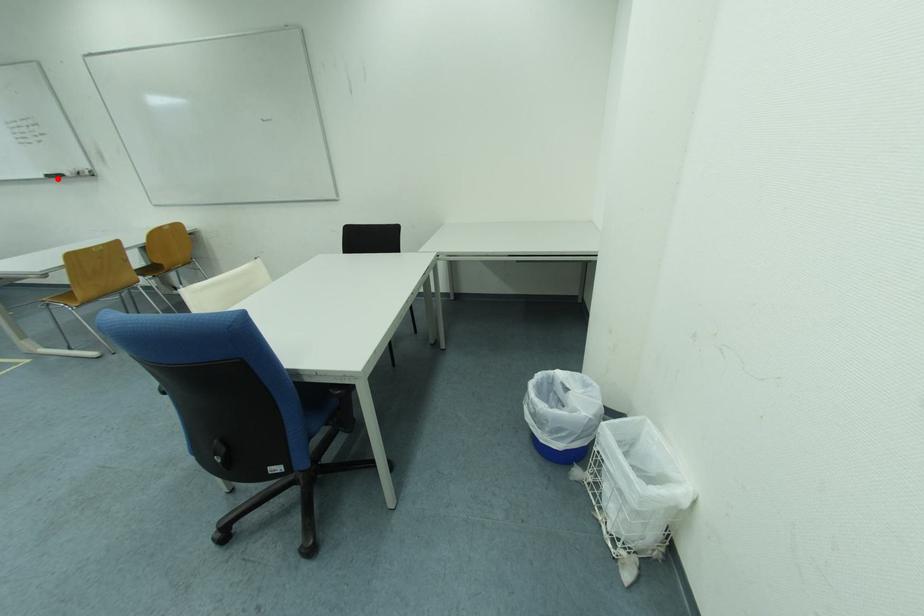
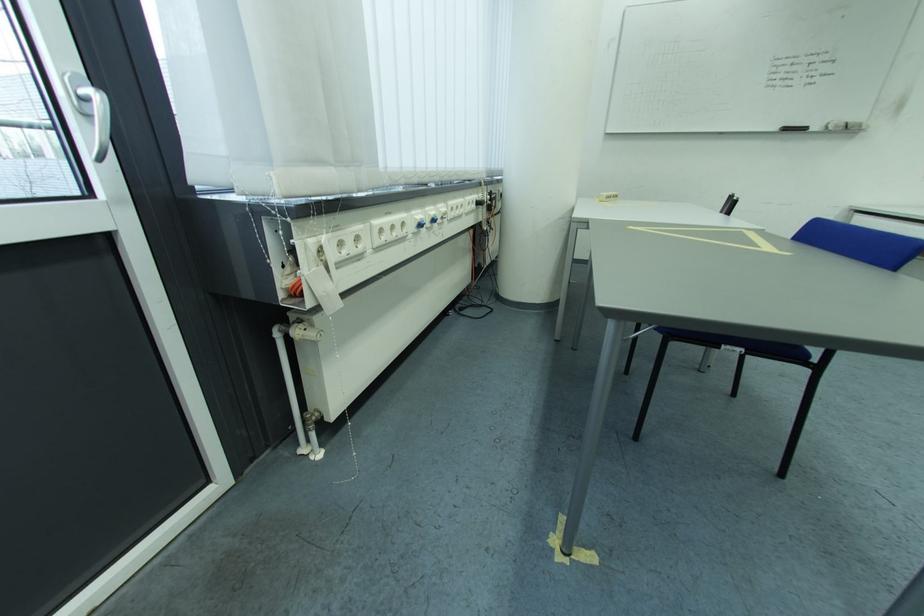
Find the pixel in the second image that matches the highlighted location in the first image.

(796, 131)